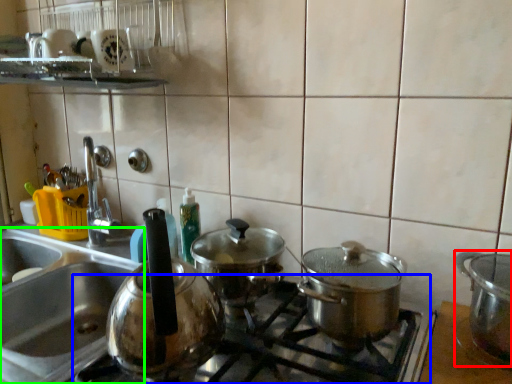
Question: Estimate the real-world distances between objects in this image. Which object is closer to kitchen appliance (highlighted by a red box), gas stove (highlighted by a blue box) or sink (highlighted by a green box)?

Choices:
 (A) gas stove
 (B) sink

Answer: (A)